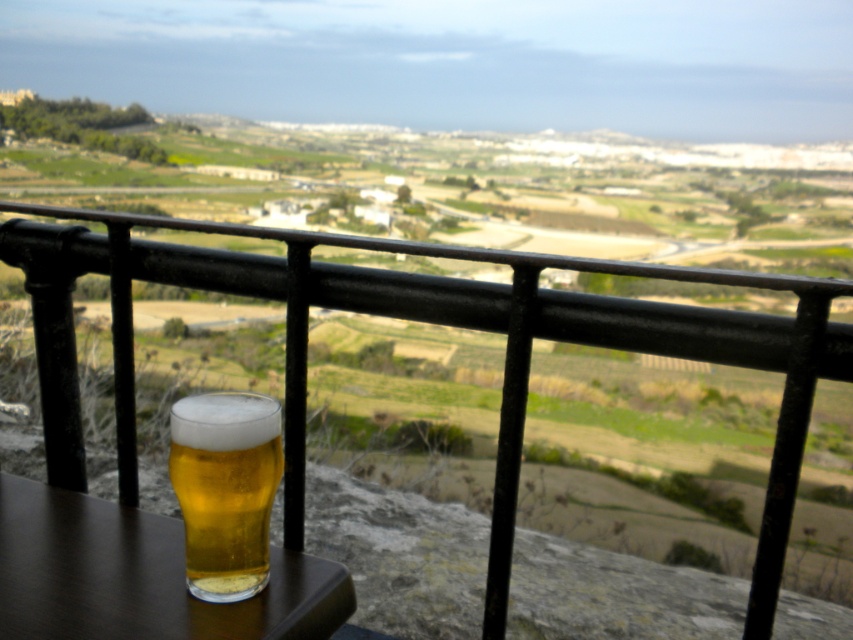
You are a photographer trying to capture the golden glass beer at lower left without the black metal railing at upper center blocking the view. Based on their sizes, is it possible to frame the shot so the beer is visible without the railing obscuring it?

The black metal railing at upper center is much taller than the golden glass beer at lower left. Since the railing is taller, it might still block part of the beer unless the camera angle is adjusted to lower the framing or move closer to the beer to minimize the railing in the shot.

In the scene shown: You are standing on a balcony and want to place a small plant pot on the brown wood table at lower left. However, you need to ensure that the plant pot won not block the view of the black metal railing at upper center. Can you do this?

The black metal railing at upper center is above the brown wood table at lower left, so placing the plant pot on the brown wood table at lower left will not block the view of the black metal railing at upper center.